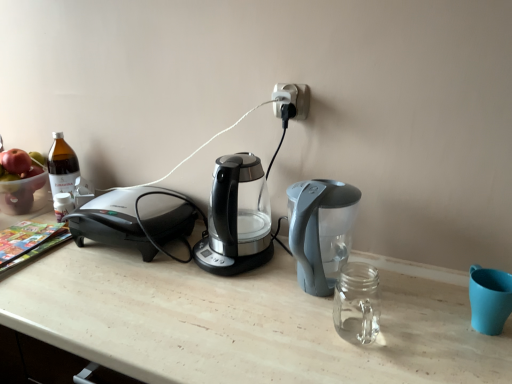
This screenshot has height=384, width=512. Identify the location of black plastic plug at upper center. (292, 99).

What do you see at coordinates (24, 195) in the screenshot?
I see `translucent plastic bowl at left` at bounding box center [24, 195].

What do you see at coordinates (236, 219) in the screenshot?
I see `transparent glass coffee maker at center` at bounding box center [236, 219].

Where is `black plastic plug at upper center`? black plastic plug at upper center is located at coordinates [292, 99].

Which is behind, point (297, 86) or point (40, 205)?

Point (40, 205)

Which object is thinner, black plastic plug at upper center or translucent plastic bowl at left?

Thinner between the two is black plastic plug at upper center.

Measure the distance from black plastic plug at upper center to translucent plastic bowl at left.

85.11 centimeters.

How many degrees apart are the facing directions of transparent glass coffee maker at center and translucent plastic bowl at left?

There is a 88.2-degree angle between the facing directions of transparent glass coffee maker at center and translucent plastic bowl at left.

Is the depth of transparent glass coffee maker at center greater than that of translucent plastic bowl at left?

No, it is in front of translucent plastic bowl at left.

Is transparent glass coffee maker at center located outside translucent plastic bowl at left?

transparent glass coffee maker at center lies outside translucent plastic bowl at left's area.

Would you say transparent glass coffee maker at center is to the left or to the right of translucent plastic bowl at left in the picture?

Based on their positions, transparent glass coffee maker at center is located to the right of translucent plastic bowl at left.

Is translucent plastic bowl at left outside of transparent glass coffee maker at center?

That's correct, translucent plastic bowl at left is outside of transparent glass coffee maker at center.

Considering the points (37, 186) and (231, 157), which point is in front, point (37, 186) or point (231, 157)?

The point (231, 157) is more forward.

From the image's perspective, is translucent plastic bowl at left on top of transparent glass coffee maker at center?

Yes, from the image's perspective, translucent plastic bowl at left is above transparent glass coffee maker at center.

Identify the location of power plugs and sockets on the right side of transparent glass coffee maker at center. The image size is (512, 384). (292, 99).

From a real-world perspective, is black plastic plug at upper center on transparent glass coffee maker at center?

Correct, in the physical world, black plastic plug at upper center is higher than transparent glass coffee maker at center.

Is black plastic plug at upper center aimed at transparent glass coffee maker at center?

No.

Is there a large distance between translucent plastic bowl at left and black plastic plug at upper center?

That's not correct — translucent plastic bowl at left is a little close to black plastic plug at upper center.

In the scene shown: Is translucent plastic bowl at left shorter than black plastic plug at upper center?

Incorrect, the height of translucent plastic bowl at left does not fall short of that of black plastic plug at upper center.

Visually, is translucent plastic bowl at left positioned to the left or to the right of black plastic plug at upper center?

translucent plastic bowl at left is positioned on black plastic plug at upper center's left side.

Does point (23, 187) come behind point (284, 97)?

Yes, it is behind point (284, 97).

Find the location of a particular element. coffee maker on the left of black plastic plug at upper center is located at coordinates (236, 219).

Is transparent glass coffee maker at center positioned with its back to black plastic plug at upper center?

No, transparent glass coffee maker at center's orientation is not away from black plastic plug at upper center.

Which of these two, transparent glass coffee maker at center or black plastic plug at upper center, is thinner?

Thinner between the two is black plastic plug at upper center.

Does transparent glass coffee maker at center lie behind black plastic plug at upper center?

No, it is not.

The height and width of the screenshot is (384, 512). I want to click on bowl beneath the black plastic plug at upper center (from a real-world perspective), so click(x=24, y=195).

Find the location of a particular element. Image resolution: width=512 pixels, height=384 pixels. bowl that appears on the left of transparent glass coffee maker at center is located at coordinates (24, 195).

Considering their positions, is transparent glass coffee maker at center positioned closer to black plastic plug at upper center than translucent plastic bowl at left?

transparent glass coffee maker at center.

Which object lies nearer to the anchor point transparent glass coffee maker at center, translucent plastic bowl at left or black plastic plug at upper center?

The object closer to transparent glass coffee maker at center is black plastic plug at upper center.

When comparing their distances from transparent glass coffee maker at center, does black plastic plug at upper center or translucent plastic bowl at left seem closer?

Based on the image, black plastic plug at upper center appears to be nearer to transparent glass coffee maker at center.

Estimate the real-world distances between objects in this image. Which object is further from translucent plastic bowl at left, transparent glass coffee maker at center or black plastic plug at upper center?

black plastic plug at upper center.

Estimate the real-world distances between objects in this image. Which object is further from translucent plastic bowl at left, black plastic plug at upper center or transparent glass coffee maker at center?

black plastic plug at upper center is further to translucent plastic bowl at left.

When comparing their distances from black plastic plug at upper center, does translucent plastic bowl at left or transparent glass coffee maker at center seem further?

translucent plastic bowl at left.

Find the location of a particular element. coffee maker located between translucent plastic bowl at left and black plastic plug at upper center in the left-right direction is located at coordinates (236, 219).